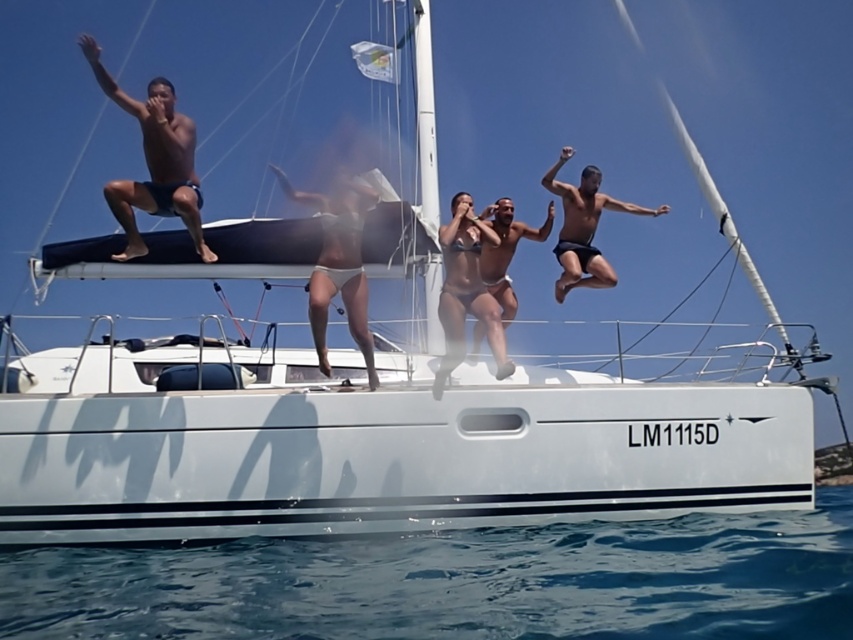
Question: Which point is farther to the camera?

Choices:
 (A) (126, 240)
 (B) (32, 552)
 (C) (503, 230)
 (D) (570, 275)

Answer: (C)

Question: Which of the following is the closest to the observer?

Choices:
 (A) transparent blue water at lower center
 (B) white bikini at center

Answer: (A)

Question: Is white bikini at center smaller than black matte shorts at center?

Choices:
 (A) no
 (B) yes

Answer: (B)

Question: Among these objects, which one is farthest from the camera?

Choices:
 (A) smooth tan skin at center
 (B) black matte shorts at center

Answer: (B)

Question: Does black matte shorts at center have a smaller size compared to smooth tan skin at center?

Choices:
 (A) no
 (B) yes

Answer: (A)

Question: Observing the image, what is the correct spatial positioning of transparent blue water at lower center in reference to dark blue swim trunks at upper left?

Choices:
 (A) below
 (B) above

Answer: (A)